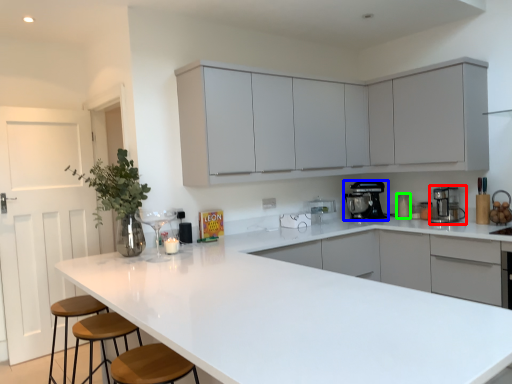
Question: Considering the real-world distances, which object is closest to home appliance (highlighted by a red box)? home appliance (highlighted by a blue box) or appliance (highlighted by a green box).

Choices:
 (A) home appliance
 (B) appliance

Answer: (B)